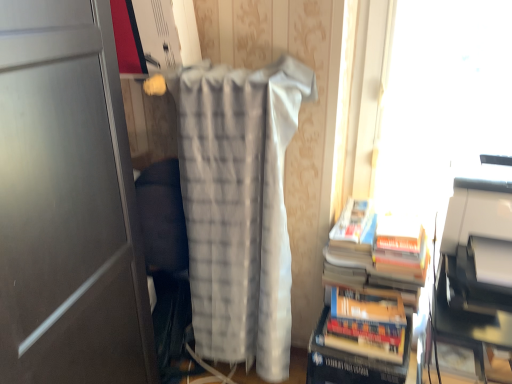
Question: Is white plastic printer at right inside transparent plastic window screen at upper right?

Choices:
 (A) yes
 (B) no

Answer: (B)

Question: Is transparent plastic window screen at upper right at the right side of white plastic printer at right?

Choices:
 (A) yes
 (B) no

Answer: (A)

Question: From a real-world perspective, is transparent plastic window screen at upper right positioned over white plastic printer at right based on gravity?

Choices:
 (A) yes
 (B) no

Answer: (B)

Question: Is the position of transparent plastic window screen at upper right less distant than that of white plastic printer at right?

Choices:
 (A) no
 (B) yes

Answer: (A)

Question: From the image's perspective, is transparent plastic window screen at upper right beneath white plastic printer at right?

Choices:
 (A) yes
 (B) no

Answer: (B)

Question: Choose the correct answer: Is hardcover book at lower right inside transparent plastic window screen at upper right or outside it?

Choices:
 (A) inside
 (B) outside

Answer: (B)

Question: From a real-world perspective, is hardcover book at lower right physically located above or below transparent plastic window screen at upper right?

Choices:
 (A) below
 (B) above

Answer: (A)

Question: Considering the positions of hardcover book at lower right and transparent plastic window screen at upper right in the image, is hardcover book at lower right bigger or smaller than transparent plastic window screen at upper right?

Choices:
 (A) small
 (B) big

Answer: (A)

Question: From the image's perspective, relative to transparent plastic window screen at upper right, is hardcover book at lower right above or below?

Choices:
 (A) below
 (B) above

Answer: (A)

Question: From a real-world perspective, is white textured blanket at center positioned above or below white plastic printer at right?

Choices:
 (A) above
 (B) below

Answer: (B)

Question: From the image's perspective, relative to white plastic printer at right, is white textured blanket at center above or below?

Choices:
 (A) below
 (B) above

Answer: (A)

Question: Is white textured blanket at center inside the boundaries of white plastic printer at right, or outside?

Choices:
 (A) outside
 (B) inside

Answer: (A)

Question: In terms of size, does white textured blanket at center appear bigger or smaller than white plastic printer at right?

Choices:
 (A) small
 (B) big

Answer: (B)

Question: Is hardcover books at right inside or outside of white plastic printer at right?

Choices:
 (A) outside
 (B) inside

Answer: (A)

Question: Is hardcover books at right in front of or behind white plastic printer at right in the image?

Choices:
 (A) behind
 (B) front

Answer: (A)